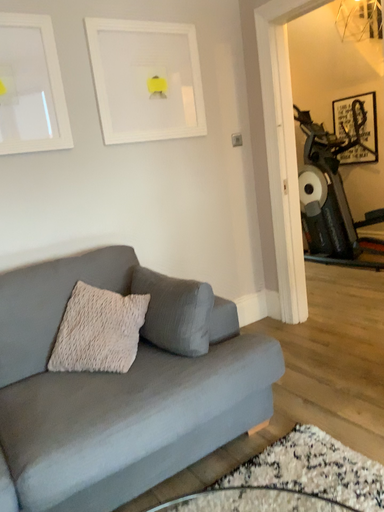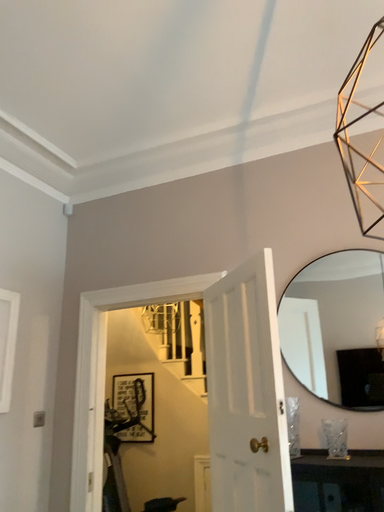
Question: How did the camera likely rotate when shooting the video?

Choices:
 (A) rotated upward
 (B) rotated downward

Answer: (A)